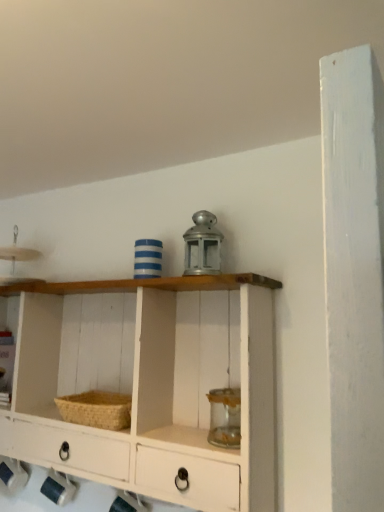
You are a GUI agent. You are given a task and a screenshot of the screen. Output one action in this format:
    pyautogui.click(x=<x>, y=<y>)
    Task: Click on the vacant space situated above woven straw basket at lower left (from a real-world perspective)
    The height and width of the screenshot is (512, 384).
    Given the screenshot: What is the action you would take?
    pyautogui.click(x=103, y=396)